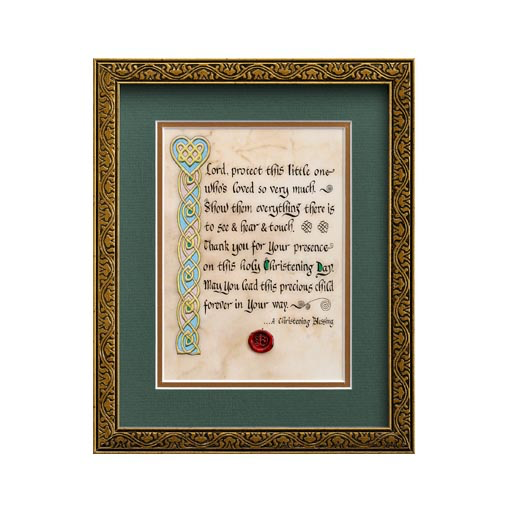
In order to click on frame edge in this screenshot , I will do `click(244, 440)`, `click(406, 263)`, `click(102, 282)`, `click(248, 67)`.